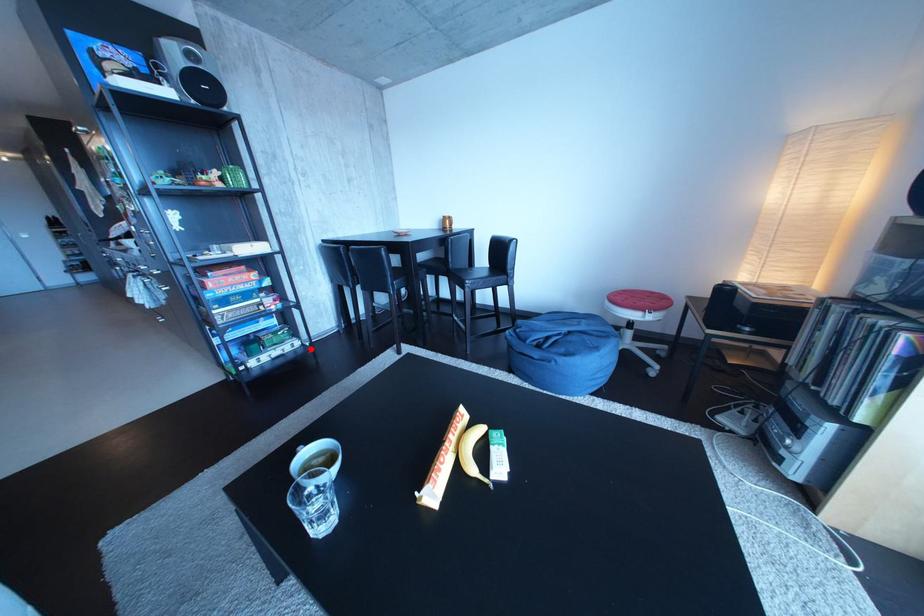
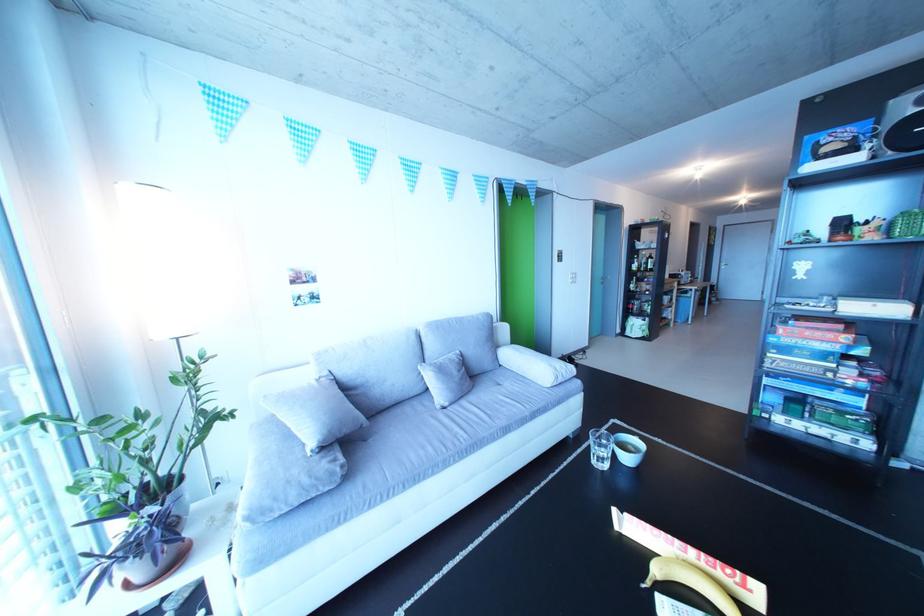
In the second image, find the point that corresponds to the highlighted location in the first image.

(881, 451)